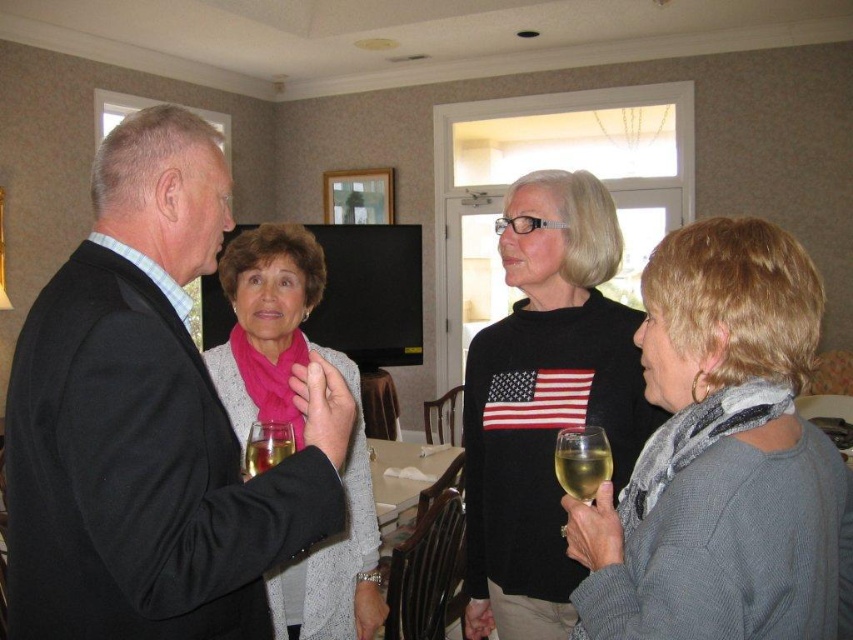
You are a photographer at the event and need to capture a closeup of the black suit at left and the translucent glass wine glass at lower right in the same frame. Given that your camera has a fixed focal length, which object should you position closer to the camera to ensure both appear proportionally sized?

The black suit at left is wider than the translucent glass wine glass at lower right. To make them appear proportionally sized in the photo, position the black suit at left farther from the camera and the translucent glass wine glass at lower right closer, since wider objects need to be farther away to match the size of smaller ones in the frame.

You are organizing a small party and need to place a decorative item between the pink scarf at center and the translucent glass at lower center. Which object should you place it closer to if you want it to be near the wider object?

The pink scarf at center is wider than the translucent glass at lower center, so you should place the decorative item closer to the pink scarf at center.

You are planning to take a photo of the black suit at left. Where should you position yourself to capture it in the frame?

The black suit at left is located at point (149, 420), so you should position yourself to the left side of the image to capture it in the frame.